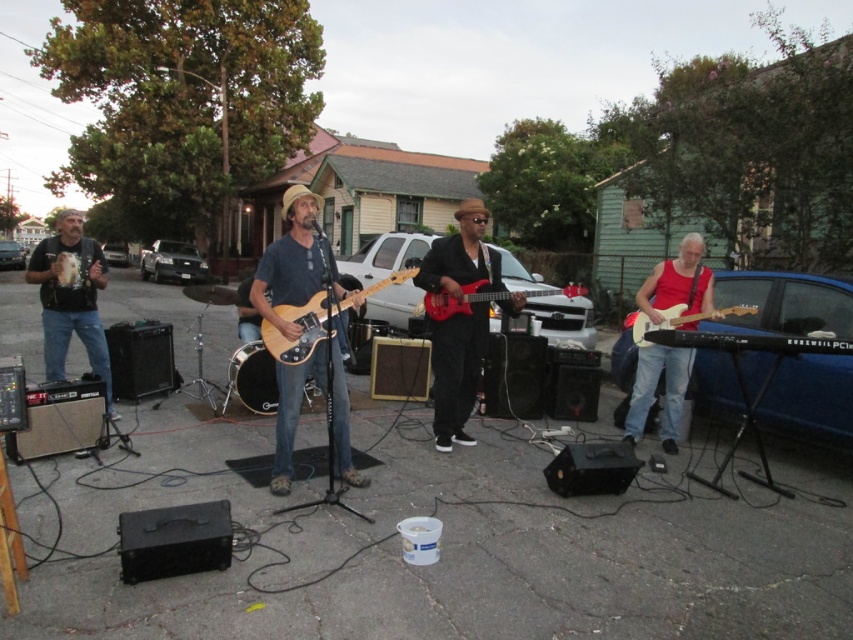
You are a street performer who needs to carry both the brown wood guitar at center and the matte wood electric guitar at right in a single case. The case can only accommodate the wider of the two guitars. Which guitar should you place in the case first?

The matte wood electric guitar at right is wider than the brown wood guitar at center, so you should place the matte wood electric guitar at right first to ensure it fits in the case.

You are a photographer trying to capture the band members. You notice the brown wood guitar at center and the shiny red electric guitar at center. Which guitar is positioned to the left of the other?

The brown wood guitar at center is to the left of the shiny red electric guitar at center.

You are a photographer trying to capture the band members with both guitars in the frame. The glossy electric guitar at center is narrower than the matte wood electric guitar at right. Which guitar should you focus on to ensure both guitars are fully visible in your shot?

The glossy electric guitar at center has a lesser width compared to the matte wood electric guitar at right, so focusing on the wider matte wood electric guitar at right will help ensure both guitars are fully visible in the frame.